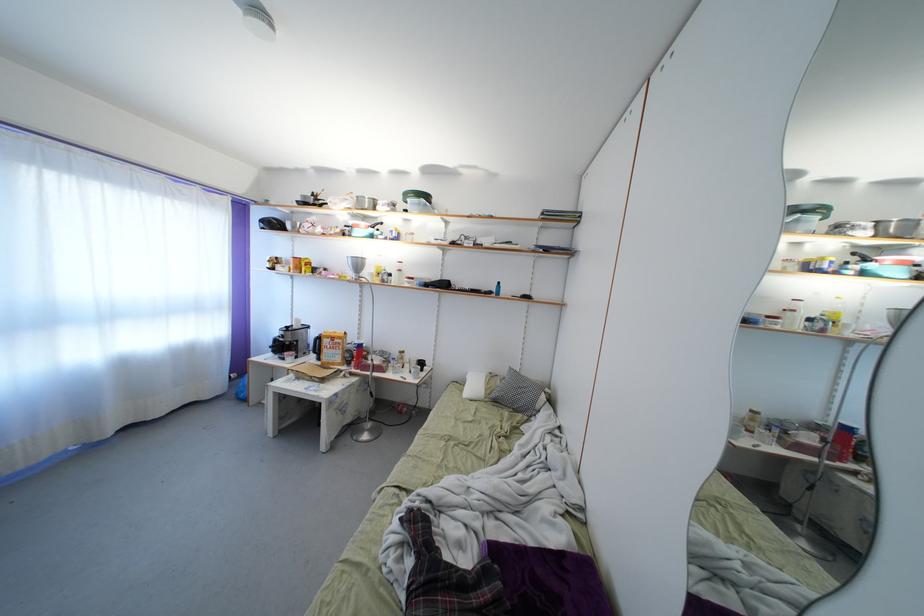
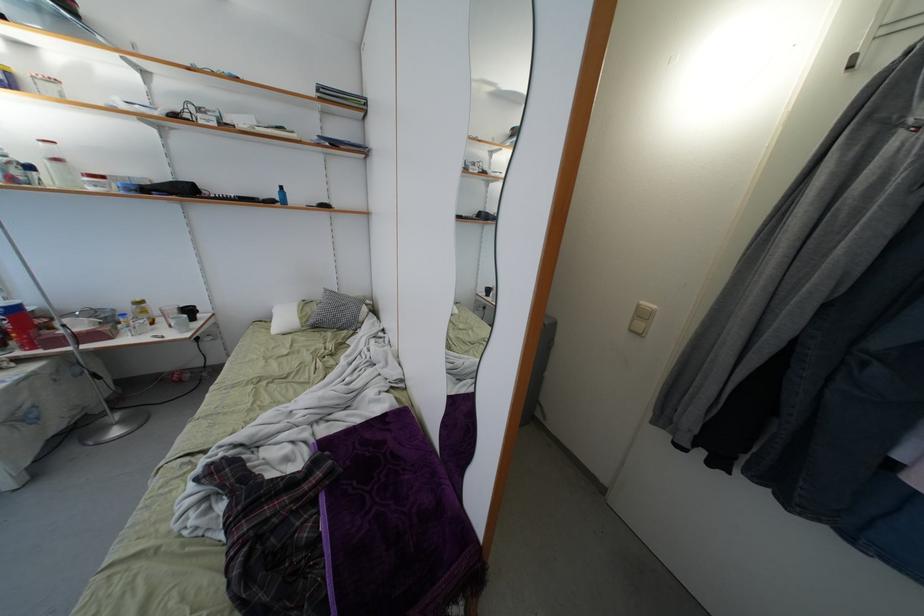
Locate, in the second image, the point that corresponds to (492,395) in the first image.

(306, 323)